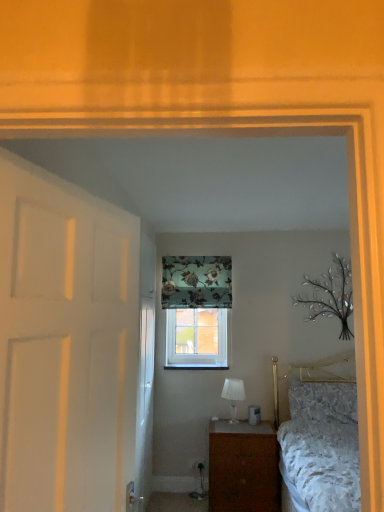
Question: Can you confirm if white matte door at left, positioned as the 1th door in front-to-back order, is wider than floral fabric curtain at upper center?

Choices:
 (A) yes
 (B) no

Answer: (A)

Question: Does white matte door at left, positioned as the 1th door in front-to-back order, have a larger size compared to floral fabric curtain at upper center?

Choices:
 (A) yes
 (B) no

Answer: (A)

Question: Does white matte door at left, positioned as the 1th door in front-to-back order, appear on the left side of floral fabric curtain at upper center?

Choices:
 (A) yes
 (B) no

Answer: (A)

Question: From a real-world perspective, is white matte door at left, the 2th door when ordered from back to front, under floral fabric curtain at upper center?

Choices:
 (A) yes
 (B) no

Answer: (A)

Question: Does white matte door at left, the 2th door when ordered from back to front, come behind floral fabric curtain at upper center?

Choices:
 (A) no
 (B) yes

Answer: (A)

Question: Is white matte door at left, the 2th door when ordered from back to front, smaller than floral fabric curtain at upper center?

Choices:
 (A) no
 (B) yes

Answer: (A)

Question: Does white glossy door at left, positioned as the second door in front-to-back order, have a larger size compared to white glass table lamp at center?

Choices:
 (A) yes
 (B) no

Answer: (A)

Question: Is the depth of white glossy door at left, placed as the first door when sorted from back to front, less than that of white glass table lamp at center?

Choices:
 (A) yes
 (B) no

Answer: (A)

Question: From a real-world perspective, is white glossy door at left, positioned as the second door in front-to-back order, physically above white glass table lamp at center?

Choices:
 (A) yes
 (B) no

Answer: (A)

Question: Does white glossy door at left, placed as the first door when sorted from back to front, have a lesser width compared to white glass table lamp at center?

Choices:
 (A) no
 (B) yes

Answer: (B)

Question: Does white glossy door at left, placed as the first door when sorted from back to front, have a lesser height compared to white glass table lamp at center?

Choices:
 (A) no
 (B) yes

Answer: (A)

Question: Considering the relative sizes of white glossy door at left, placed as the first door when sorted from back to front, and white glass table lamp at center in the image provided, is white glossy door at left, placed as the first door when sorted from back to front, wider than white glass table lamp at center?

Choices:
 (A) no
 (B) yes

Answer: (A)

Question: Does clear glass window at center contain white glass table lamp at center?

Choices:
 (A) yes
 (B) no

Answer: (B)